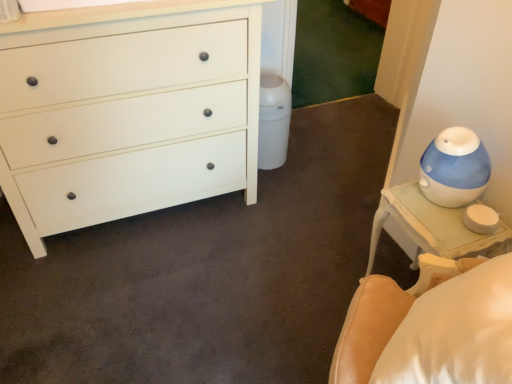
Identify the location of vacant space positioned to the left of white glossy nightstand at right. Image resolution: width=512 pixels, height=384 pixels. (322, 291).